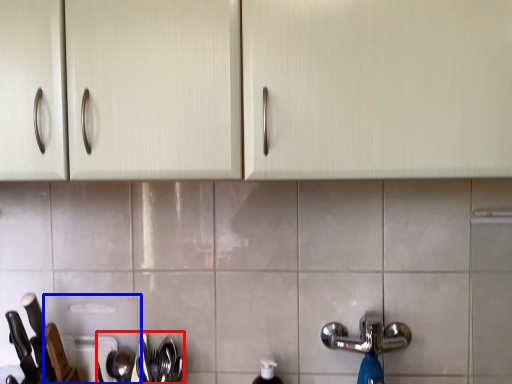
Question: Which object appears closest to the camera in this image, silverware (highlighted by a red box) or appliance (highlighted by a blue box)?

Choices:
 (A) silverware
 (B) appliance

Answer: (A)